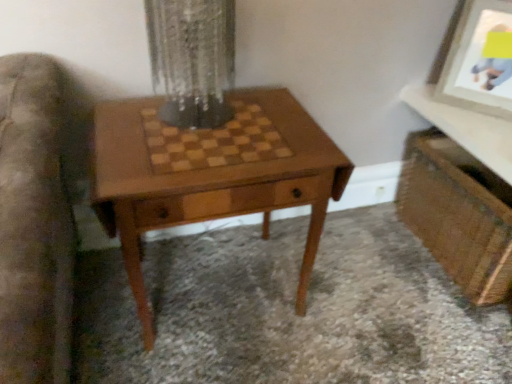
Locate an element on the screen. This screenshot has height=384, width=512. vacant area situated below clear glass vase at center (from a real-world perspective) is located at coordinates (207, 121).